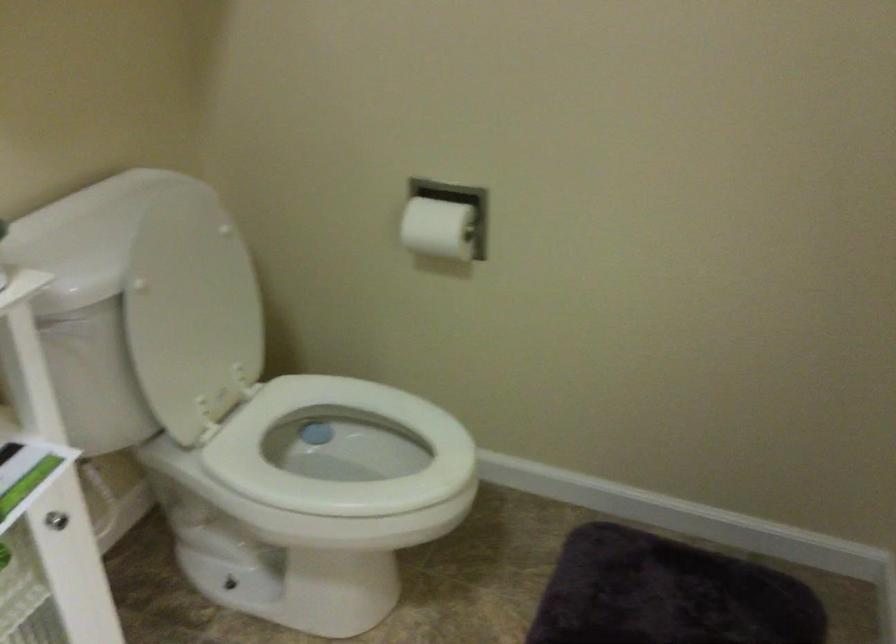
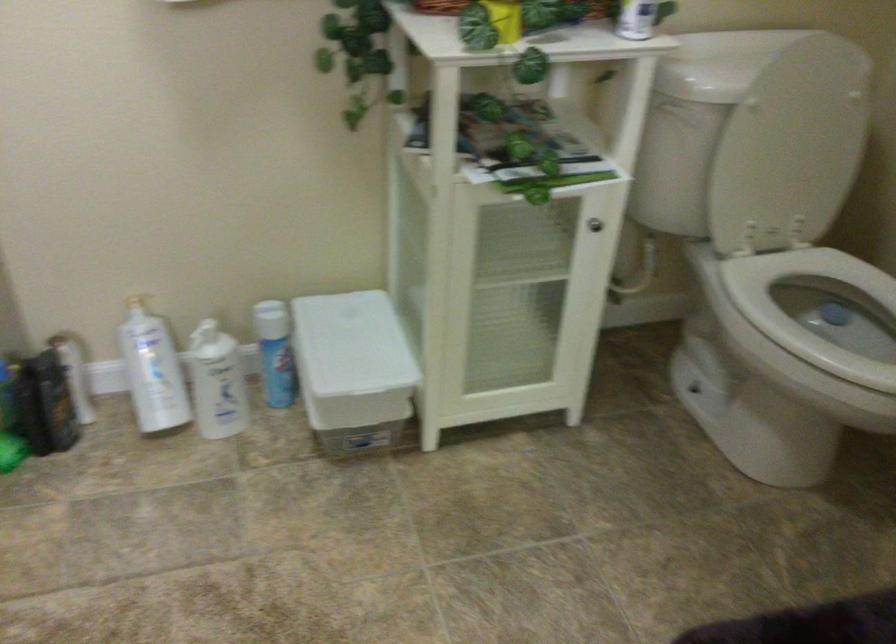
Question: The first image is from the beginning of the video and the second image is from the end. How did the camera likely rotate when shooting the video?

Choices:
 (A) Left
 (B) Right
 (C) Up
 (D) Down

Answer: (A)